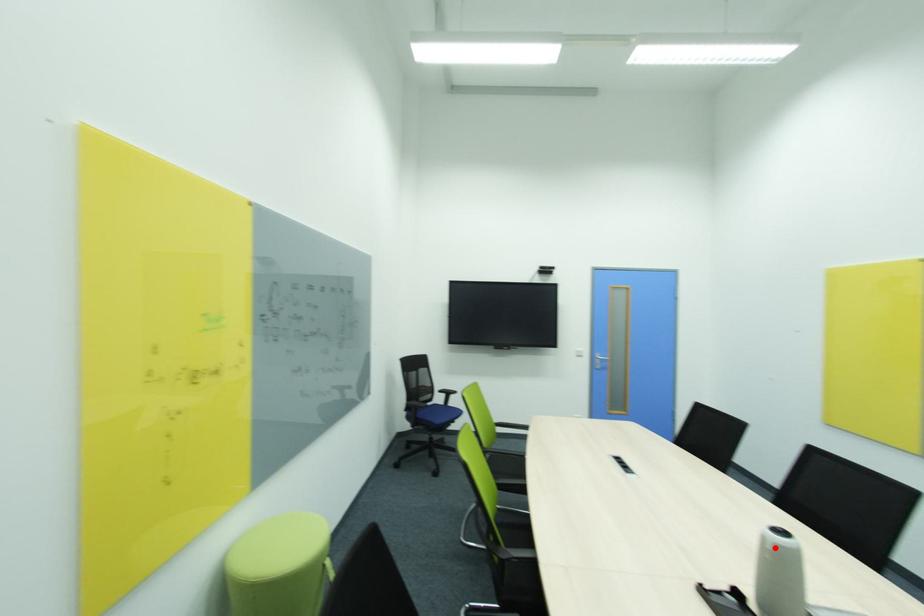
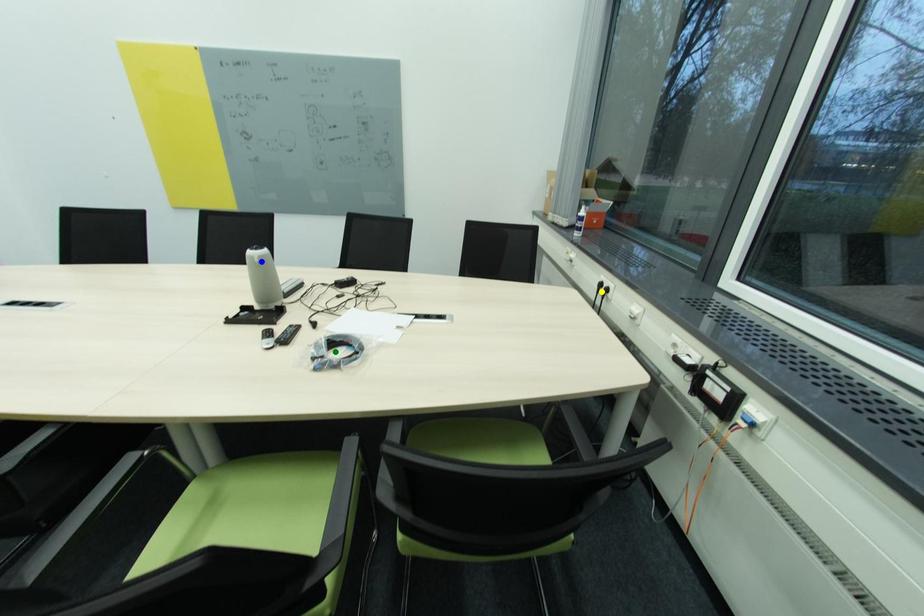
Question: I am providing you with two images of the same scene from different viewpoints. A red point is marked on the first image. You are given multiple points on the second image. Which point in image 2 represents the same 3d spot as the red point in image 1?

Choices:
 (A) blue point
 (B) green point
 (C) yellow point

Answer: (A)